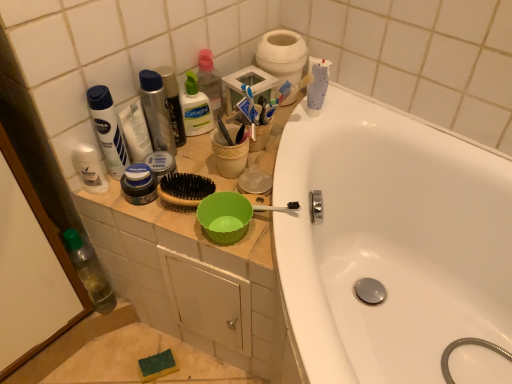
Where is `vacant area that lies to the right of white matte tube at upper left, which is counted as the first toothpaste, starting from the bottom`? This screenshot has width=512, height=384. vacant area that lies to the right of white matte tube at upper left, which is counted as the first toothpaste, starting from the bottom is located at coordinates (204, 159).